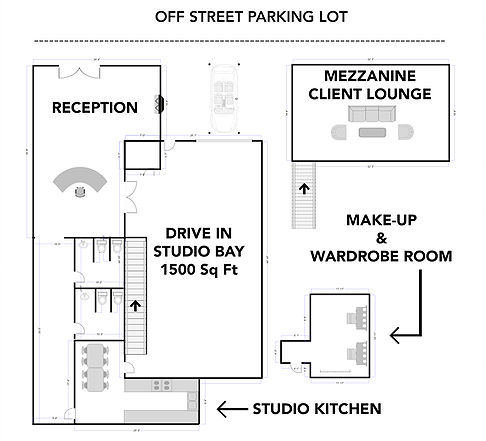
Where is `door`? door is located at coordinates (124, 203), (73, 278), (75, 325), (74, 412), (126, 367), (297, 364), (175, 143), (80, 69).